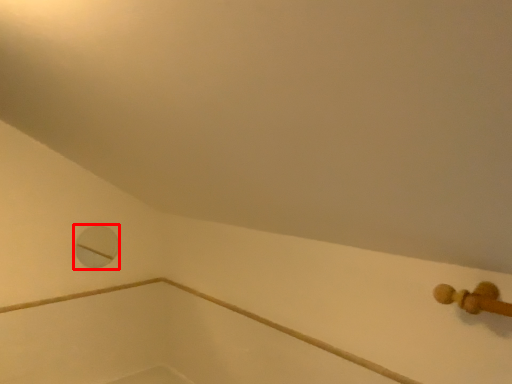
Question: From the image's perspective, where is hole (annotated by the red box) located relative to bath?

Choices:
 (A) below
 (B) above

Answer: (B)